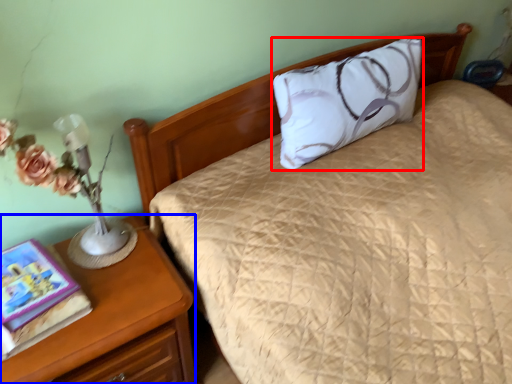
Question: Which object appears closest to the camera in this image, pillow (highlighted by a red box) or nightstand (highlighted by a blue box)?

Choices:
 (A) pillow
 (B) nightstand

Answer: (B)